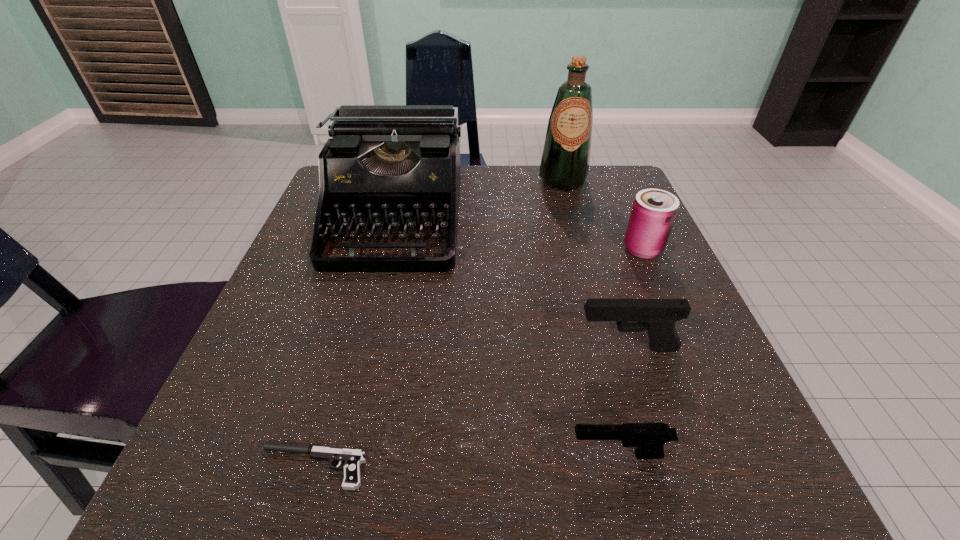
Identify the location of vacant area at the left edge of the desktop. (326, 349).

Where is `vacant region at the right edge of the desktop`? The width and height of the screenshot is (960, 540). vacant region at the right edge of the desktop is located at coordinates (610, 295).

This screenshot has width=960, height=540. In order to click on vacant space at the near left corner in this screenshot , I will do `click(181, 508)`.

This screenshot has height=540, width=960. I want to click on free area in between the olive oil and the shortest pistol, so click(438, 323).

The height and width of the screenshot is (540, 960). Identify the location of free space between the fifth shortest object and the olive oil. (478, 199).

I want to click on free point between the shortest pistol and the can, so click(477, 357).

Find the location of a particular element. The width and height of the screenshot is (960, 540). free space between the fifth shortest object and the tallest pistol is located at coordinates (511, 283).

This screenshot has width=960, height=540. In order to click on empty space that is in between the shortest pistol and the typewriter in this screenshot , I will do `click(353, 342)`.

Find the location of a particular element. This screenshot has width=960, height=540. vacant space in between the fourth farthest object and the tallest object is located at coordinates (595, 264).

I want to click on free space between the second tallest object and the shortest object, so click(x=353, y=342).